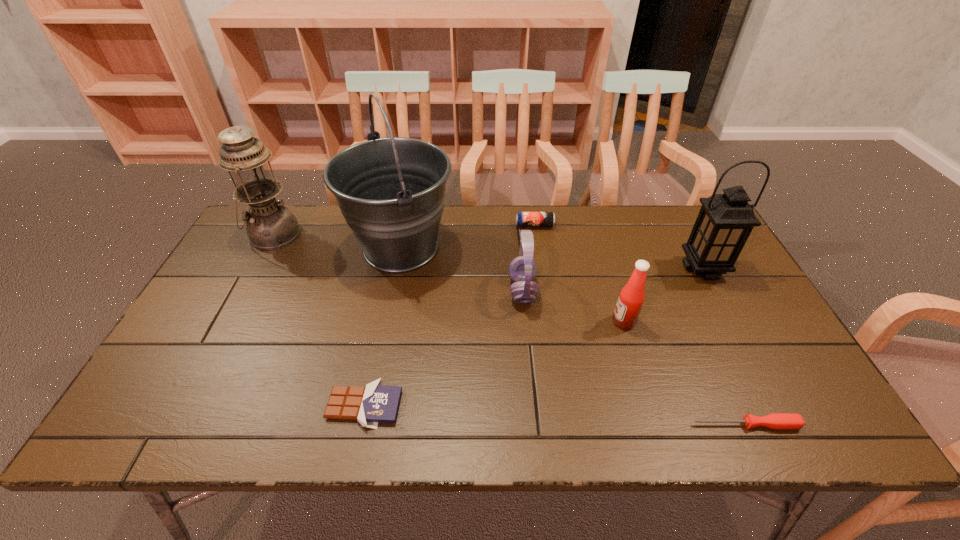
I want to click on vacant space that's between the sixth object from left to right and the oil lamp, so click(x=448, y=278).

Identify the location of blank region between the beer can and the chocolate bar. (449, 315).

What are the coordinates of `free space between the lantern and the headset` in the screenshot? It's located at pyautogui.click(x=612, y=279).

Identify the location of vacant point located between the sixth object from left to right and the third shortest object. (579, 273).

Find the location of a particular element. The image size is (960, 540). free space that is in between the sixth tallest object and the screwdriver is located at coordinates (640, 325).

The height and width of the screenshot is (540, 960). Find the location of `unoccupied position between the screwdriver and the lantern`. unoccupied position between the screwdriver and the lantern is located at coordinates (724, 346).

The image size is (960, 540). In order to click on free spot between the lantern and the chocolate bar in this screenshot , I will do `click(534, 337)`.

The width and height of the screenshot is (960, 540). I want to click on object that is the closest to the condiment, so click(522, 269).

Locate an element on the screen. This screenshot has height=540, width=960. object that stands as the second closest to the screwdriver is located at coordinates (725, 221).

The width and height of the screenshot is (960, 540). In order to click on free location that satisfies the following two spatial constraints: 1. on the back side of the tallest object; 2. on the left side of the chocolate bar in this screenshot , I will do `click(397, 248)`.